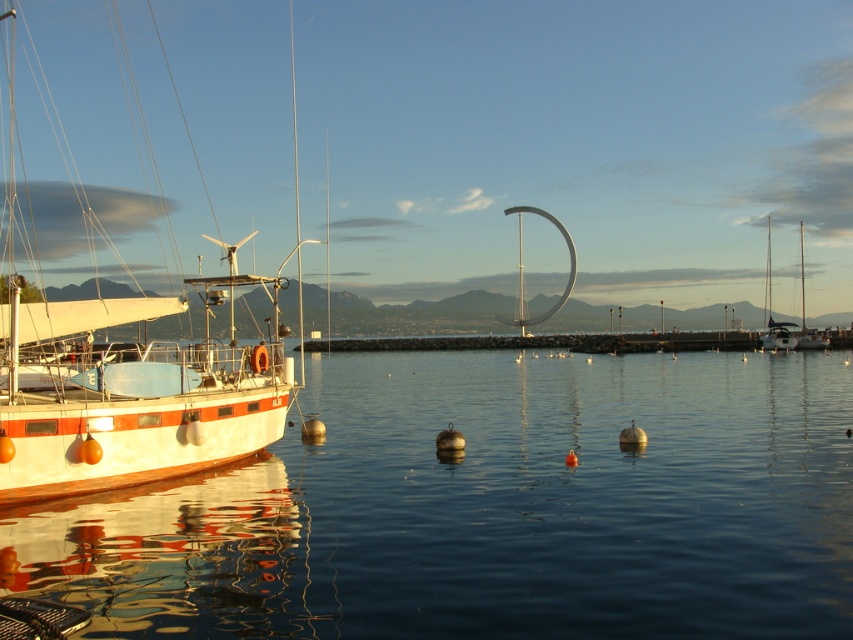
Question: Is transparent water at center bigger than white glossy sailboat at right?

Choices:
 (A) yes
 (B) no

Answer: (B)

Question: Which point appears closest to the camera in this image?

Choices:
 (A) (804, 305)
 (B) (62, 419)

Answer: (B)

Question: Is white matte boat at left bigger than white matte sailboat at right?

Choices:
 (A) yes
 (B) no

Answer: (A)

Question: Where is white matte boat at left located in relation to white glossy sailboat at right in the image?

Choices:
 (A) right
 (B) left

Answer: (B)

Question: Which object is farther from the camera taking this photo?

Choices:
 (A) white matte sailboat at right
 (B) white matte boat at left

Answer: (A)

Question: Among these objects, which one is farthest from the camera?

Choices:
 (A) white matte boat at left
 (B) transparent water at center
 (C) white matte sailboat at right

Answer: (C)